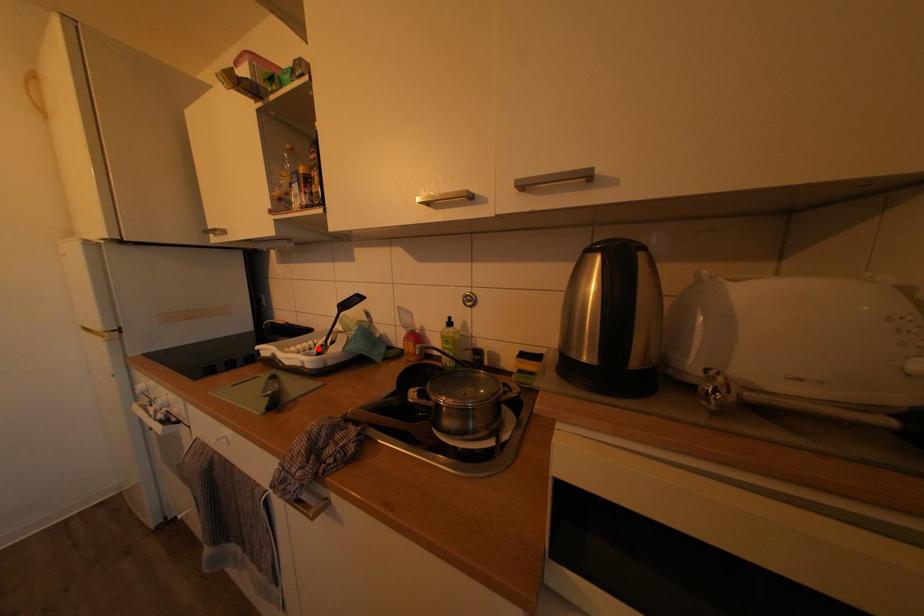
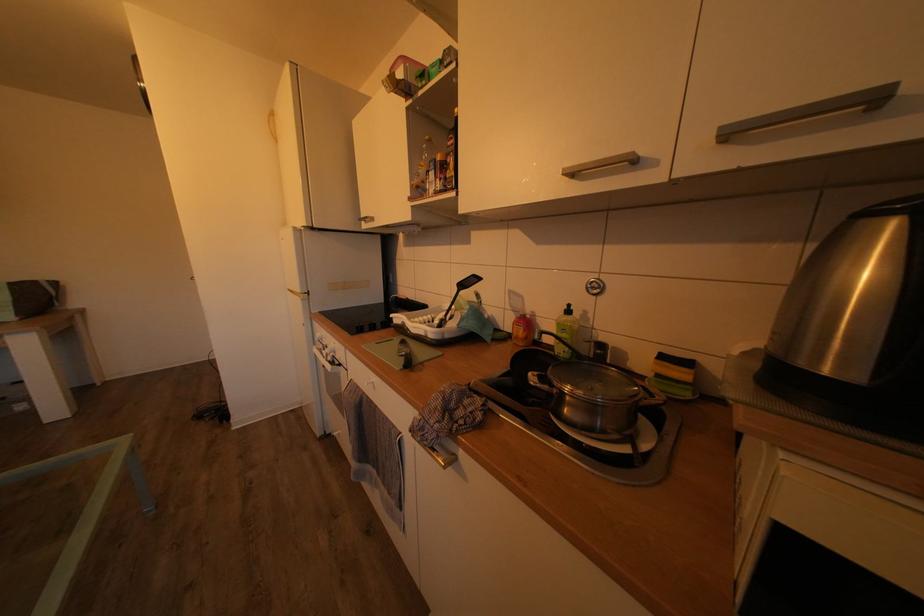
Locate, in the second image, the point that corresponds to the highlighted location in the first image.

(436, 323)